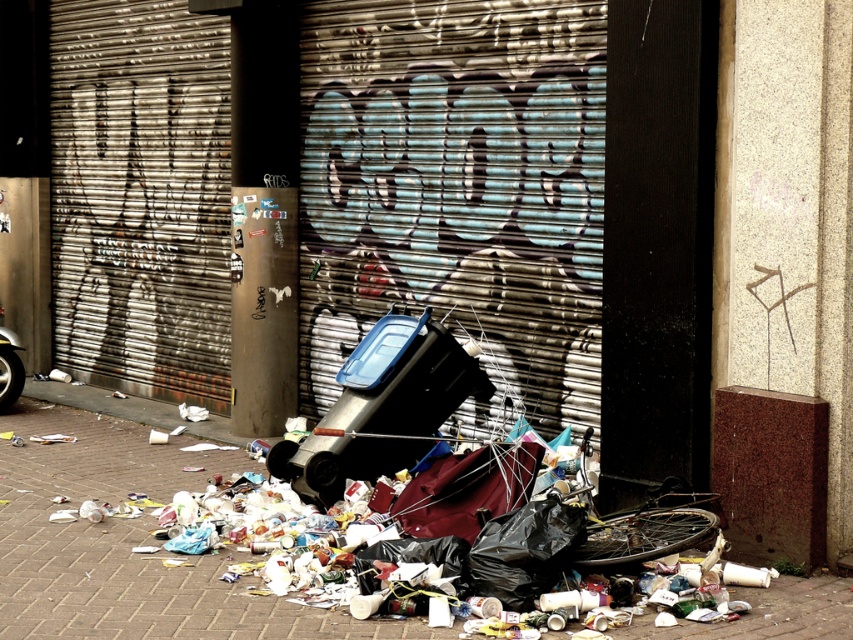
What do you see at coordinates (515, 208) in the screenshot? This screenshot has width=853, height=640. I see `brushed metal garage door at center` at bounding box center [515, 208].

Based on the photo, does brushed metal garage door at center come in front of brick pavement at lower center?

No, it is behind brick pavement at lower center.

Between point (610, 33) and point (22, 481), which one is positioned behind?

The point (22, 481) is behind.

Locate an element on the screen. Image resolution: width=853 pixels, height=640 pixels. brushed metal garage door at center is located at coordinates (515, 208).